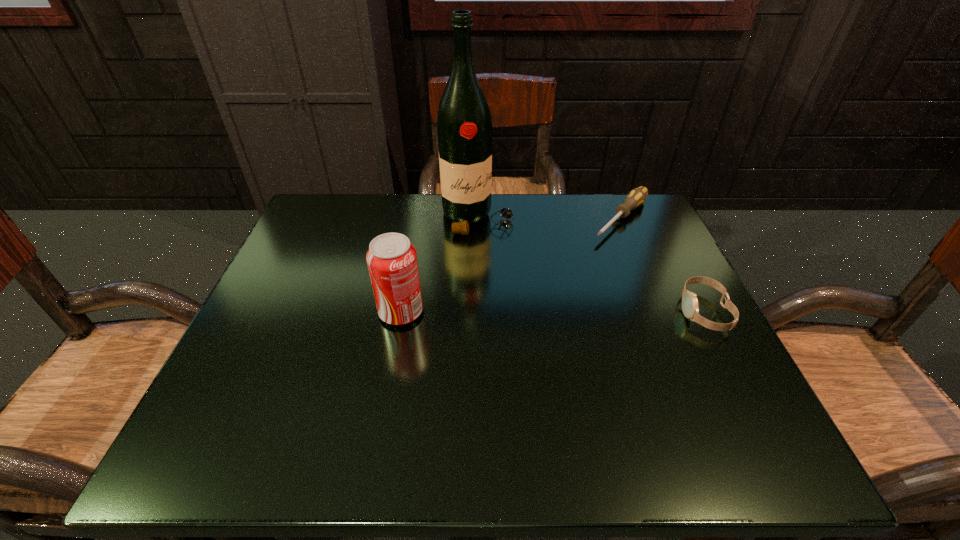
Where is `watch at the right edge`? The height and width of the screenshot is (540, 960). watch at the right edge is located at coordinates (690, 308).

Where is `screwdriver present at the right edge`? The width and height of the screenshot is (960, 540). screwdriver present at the right edge is located at coordinates (636, 197).

Where is `object that is at the far right corner`? Image resolution: width=960 pixels, height=540 pixels. object that is at the far right corner is located at coordinates [x=636, y=197].

Find the location of a particular element. Image resolution: width=960 pixels, height=540 pixels. vacant area at the far edge of the desktop is located at coordinates (565, 208).

This screenshot has width=960, height=540. Find the location of `vacant space at the near edge of the desktop`. vacant space at the near edge of the desktop is located at coordinates (404, 397).

Image resolution: width=960 pixels, height=540 pixels. I want to click on free space at the left edge, so click(323, 316).

Find the location of a particular element. This screenshot has width=960, height=540. free space at the far left corner of the desktop is located at coordinates (342, 247).

Identify the location of vacant region at the near left corner of the desktop. (266, 401).

Locate an element on the screen. The height and width of the screenshot is (540, 960). vacant space at the far right corner of the desktop is located at coordinates point(644,224).

Where is `free space that is in between the second shortest object and the wine bottle`? free space that is in between the second shortest object and the wine bottle is located at coordinates (590, 265).